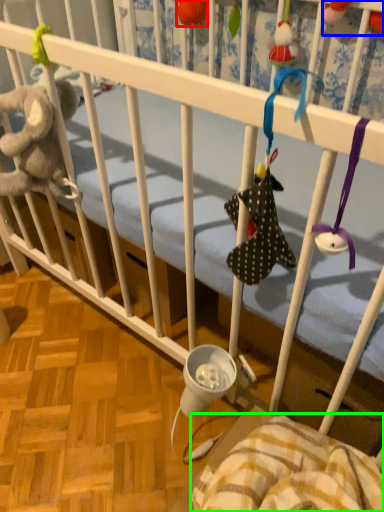
Question: Which object is positioned closest to toy (highlighted by a red box)? Select from toy (highlighted by a blue box) and blanket (highlighted by a green box).

Choices:
 (A) toy
 (B) blanket

Answer: (A)